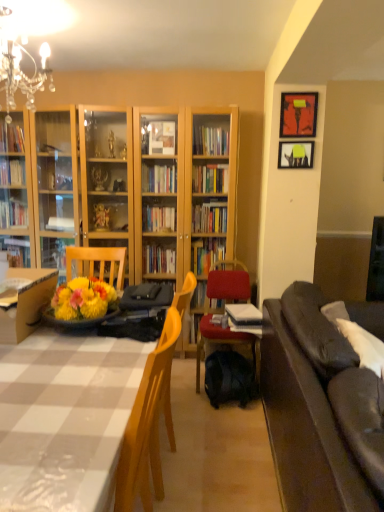
Question: Does velvet red chair at center appear on the left side of white checkered table at lower left?

Choices:
 (A) yes
 (B) no

Answer: (B)

Question: Considering the relative sizes of velvet red chair at center and white checkered table at lower left in the image provided, is velvet red chair at center smaller than white checkered table at lower left?

Choices:
 (A) yes
 (B) no

Answer: (B)

Question: Does velvet red chair at center touch white checkered table at lower left?

Choices:
 (A) yes
 (B) no

Answer: (B)

Question: Can you confirm if velvet red chair at center is wider than white checkered table at lower left?

Choices:
 (A) yes
 (B) no

Answer: (A)

Question: Can you confirm if velvet red chair at center is bigger than white checkered table at lower left?

Choices:
 (A) no
 (B) yes

Answer: (B)

Question: Is velvet red chair at center oriented towards white checkered table at lower left?

Choices:
 (A) no
 (B) yes

Answer: (B)

Question: Is matte black picture frame at upper right, marked as the 1th picture frame in a top-to-bottom arrangement, surrounded by white paper stack at center?

Choices:
 (A) yes
 (B) no

Answer: (B)

Question: From the image's perspective, is white paper stack at center under matte black picture frame at upper right, the 2th picture frame ordered from the bottom?

Choices:
 (A) yes
 (B) no

Answer: (A)

Question: Is white paper stack at center bigger than matte black picture frame at upper right, marked as the 1th picture frame in a top-to-bottom arrangement?

Choices:
 (A) no
 (B) yes

Answer: (B)

Question: Is white paper stack at center in contact with matte black picture frame at upper right, marked as the 1th picture frame in a top-to-bottom arrangement?

Choices:
 (A) yes
 (B) no

Answer: (B)

Question: From a real-world perspective, is white paper stack at center on top of matte black picture frame at upper right, the 2th picture frame ordered from the bottom?

Choices:
 (A) no
 (B) yes

Answer: (A)

Question: Considering the relative sizes of white paper stack at center and matte black picture frame at upper right, marked as the 1th picture frame in a top-to-bottom arrangement, in the image provided, is white paper stack at center wider than matte black picture frame at upper right, marked as the 1th picture frame in a top-to-bottom arrangement,?

Choices:
 (A) no
 (B) yes

Answer: (B)

Question: Is dark brown leather couch at right facing towards matte black picture frame at upper right, which is counted as the second picture frame, starting from the top?

Choices:
 (A) no
 (B) yes

Answer: (A)